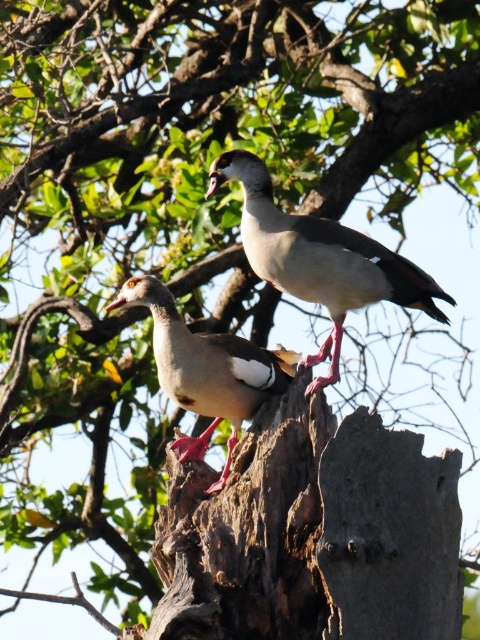
At what (x,y) coordinates should I click in order to perform the action: click on brown rough tree trunk at center. Please return your answer as a coordinate pair (x, y). The width and height of the screenshot is (480, 640). Looking at the image, I should click on (312, 534).

Is point (267, 630) more distant than point (402, 262)?

No, it is not.

This screenshot has height=640, width=480. Describe the element at coordinates (312, 534) in the screenshot. I see `brown rough tree trunk at center` at that location.

Locate an element on the screen. brown rough tree trunk at center is located at coordinates (312, 534).

Can you confirm if white feathered duck at center is positioned below brown feathered duck at center?

No, white feathered duck at center is not below brown feathered duck at center.

Which is above, white feathered duck at center or brown feathered duck at center?

white feathered duck at center is higher up.

This screenshot has height=640, width=480. In order to click on white feathered duck at center in this screenshot , I will do (x=320, y=259).

Where is `white feathered duck at center`? The height and width of the screenshot is (640, 480). white feathered duck at center is located at coordinates (320, 259).

Between point (448, 611) and point (177, 353), which one is positioned in front?

Point (448, 611) is in front.

Which is in front, point (289, 561) or point (155, 291)?

Positioned in front is point (289, 561).

At what (x,y) coordinates should I click in order to perform the action: click on brown rough tree trunk at center. Please return your answer as a coordinate pair (x, y). This screenshot has width=480, height=640. Looking at the image, I should click on (312, 534).